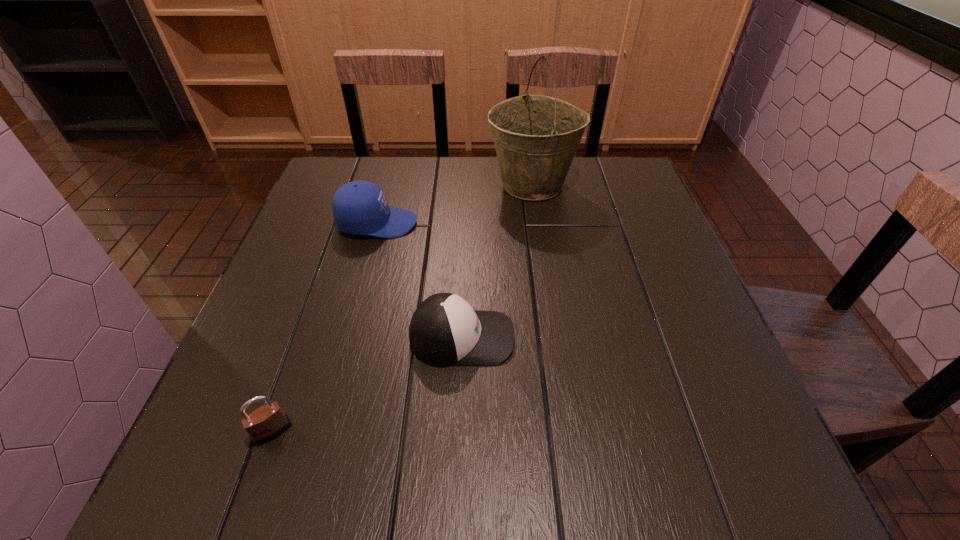
Where is `object that is at the near edge`? The width and height of the screenshot is (960, 540). object that is at the near edge is located at coordinates (266, 423).

Identify the location of cap present at the left edge. (359, 207).

The height and width of the screenshot is (540, 960). Find the location of `padlock present at the left edge`. padlock present at the left edge is located at coordinates (266, 423).

You are a GUI agent. You are given a task and a screenshot of the screen. Output one action in this format:
    pyautogui.click(x=<x>, y=<y>)
    Task: Click on the object located in the near left corner section of the desktop
    
    Given the screenshot: What is the action you would take?
    pyautogui.click(x=266, y=423)

The height and width of the screenshot is (540, 960). Find the location of `free space at the far edge of the desktop`. free space at the far edge of the desktop is located at coordinates (579, 168).

In the image, there is a desktop. At what (x,y) coordinates should I click in order to perform the action: click on vacant space at the near edge. Please return your answer as a coordinate pair (x, y). This screenshot has height=540, width=960. Looking at the image, I should click on (457, 468).

Image resolution: width=960 pixels, height=540 pixels. Find the location of `free space at the left edge of the desktop`. free space at the left edge of the desktop is located at coordinates (304, 220).

You are a GUI agent. You are given a task and a screenshot of the screen. Output one action in this format:
    pyautogui.click(x=<x>, y=<y>)
    Task: Click on the vacant region at the right edge of the desktop
    
    Given the screenshot: What is the action you would take?
    pyautogui.click(x=746, y=431)

This screenshot has height=540, width=960. Find the location of `vacant space at the far left corner`. vacant space at the far left corner is located at coordinates (x=358, y=158).

This screenshot has width=960, height=540. I want to click on blank region between the wine bucket and the nearest object, so click(402, 308).